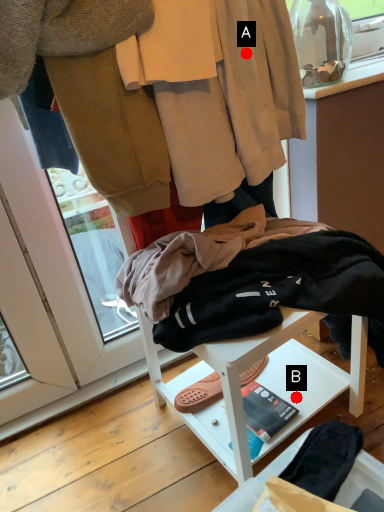
Question: Two points are circled on the image, labeled by A and B beside each circle. Among these points, which one is farthest from the camera?

Choices:
 (A) A is further
 (B) B is further

Answer: (B)